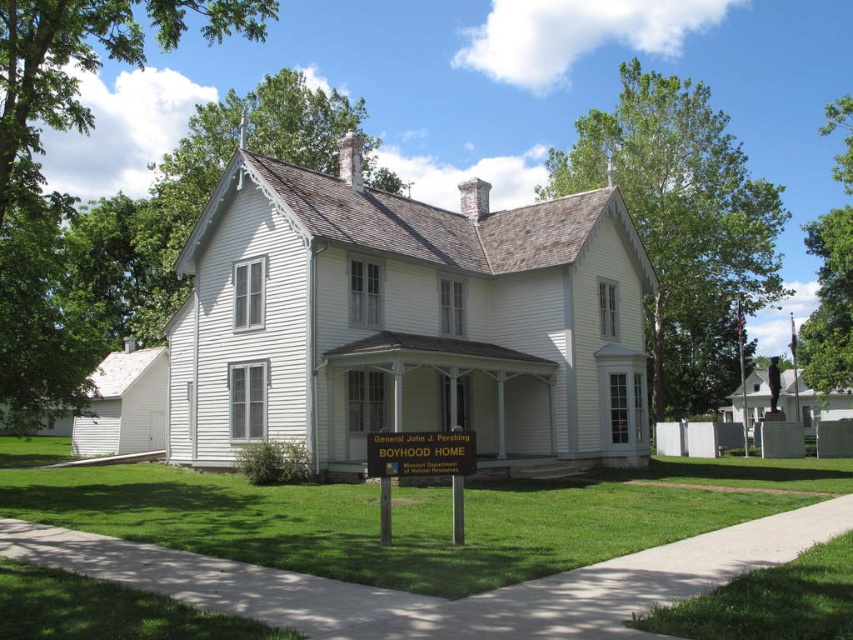
Does green wooden sign at center have a smaller size compared to metallic gold sign at center?

Correct, green wooden sign at center occupies less space than metallic gold sign at center.

Can you confirm if green wooden sign at center is wider than metallic gold sign at center?

No, green wooden sign at center is not wider than metallic gold sign at center.

Which is in front, point (384, 490) or point (421, 464)?

Point (384, 490) is more forward.

Locate an element on the screen. Image resolution: width=853 pixels, height=640 pixels. green wooden sign at center is located at coordinates (421, 467).

Is green grass at center thinner than green wooden sign at center?

In fact, green grass at center might be wider than green wooden sign at center.

Which is above, green grass at center or green wooden sign at center?

Positioned higher is green wooden sign at center.

Does point (480, 580) come farther from viewer compared to point (450, 429)?

That is False.

At what (x,y) coordinates should I click in order to perform the action: click on green grass at center. Please return your answer as a coordinate pair (x, y). Looking at the image, I should click on (415, 516).

Which of these two, green grass at center or metallic gold sign at center, stands shorter?

With less height is metallic gold sign at center.

Does green grass at center appear on the left side of metallic gold sign at center?

No, green grass at center is not to the left of metallic gold sign at center.

Measure the distance between point (511, 518) and camera.

Point (511, 518) and camera are 18.46 meters apart from each other.

Where is `green grass at center`? The image size is (853, 640). green grass at center is located at coordinates (415, 516).